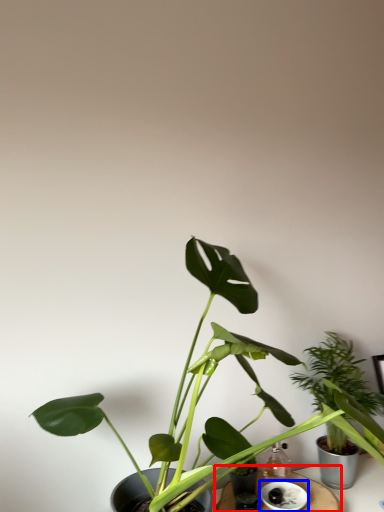
Question: Among these objects, which one is nearest to the camera, table (highlighted by a red box) or saucer (highlighted by a blue box)?

Choices:
 (A) table
 (B) saucer

Answer: (A)